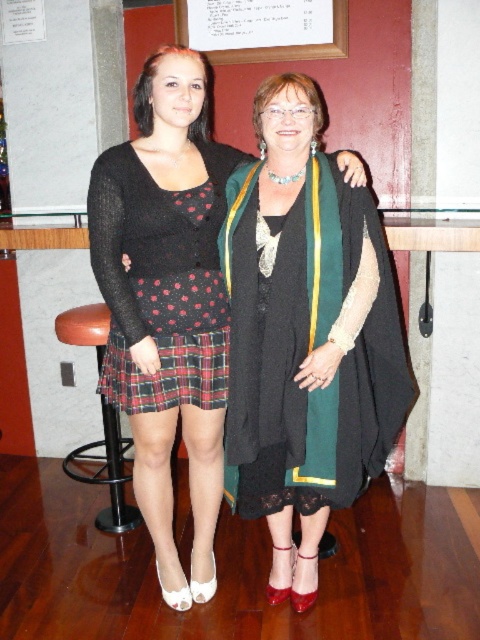
You are a fashion designer observing the scene and want to recommend a matching accessory for the plaid fabric skirt at lower center and the brown leather stool at lower left. Based on their sizes, which object would you suggest a smaller accessory for?

The plaid fabric skirt at lower center has a smaller size compared to the brown leather stool at lower left, so a smaller accessory would be more appropriate for the plaid fabric skirt at lower center.

You are taking a photo of two people standing in a bar. The first person is at point [226,353] and the second is at point [123,449]. Which person will appear larger in your photo?

The person at point [226,353] will appear larger in the photo because they are closer to the camera than the person at point [123,449].